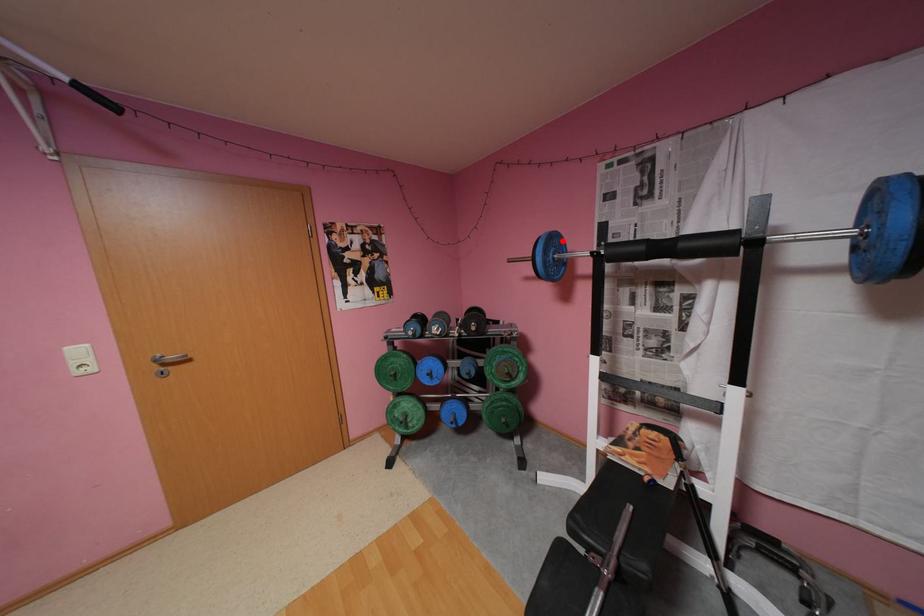
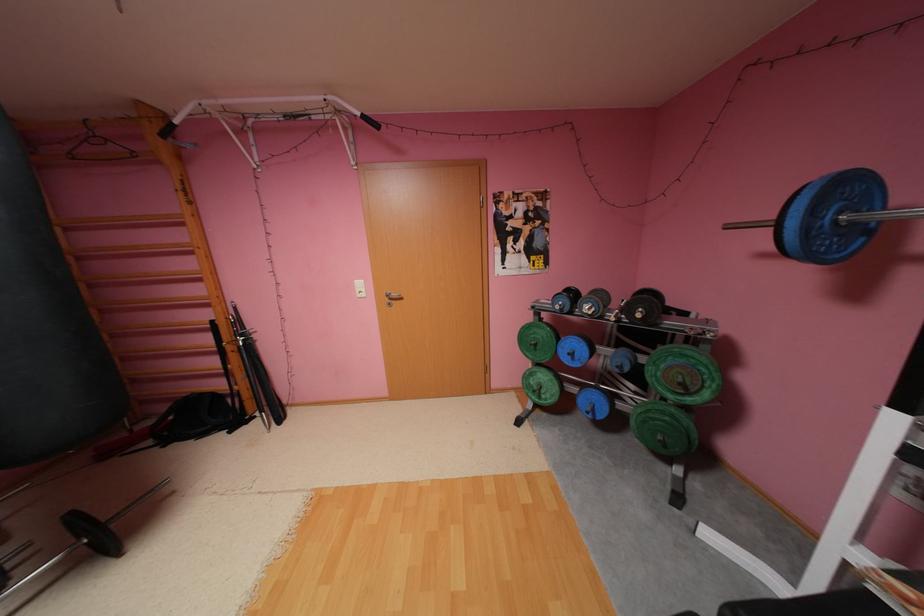
Locate, in the second image, the point that corresponds to the highlighted location in the first image.

(855, 188)